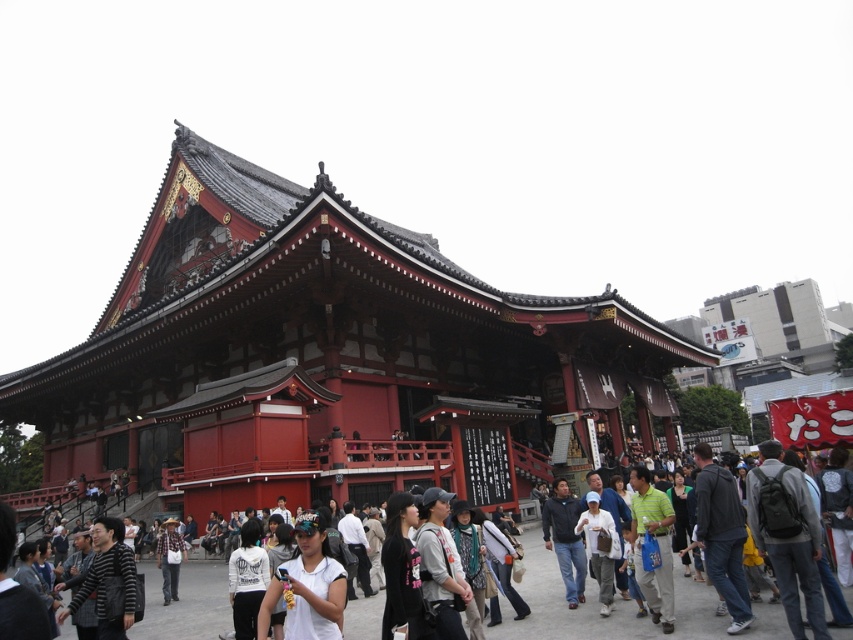
Measure the distance between point (x=432, y=609) and camera.

A distance of 35.39 meters exists between point (x=432, y=609) and camera.

Is the position of gray fabric backpack at center more distant than that of green matte shirt at center?

No, it is in front of green matte shirt at center.

Which is in front, point (422, 515) or point (646, 506)?

Positioned in front is point (422, 515).

Find the location of a particular element. gray fabric backpack at center is located at coordinates (440, 564).

You are a GUI agent. You are given a task and a screenshot of the screen. Output one action in this format:
    pyautogui.click(x=<x>, y=<y>)
    Task: Click on the black matte shirt at center
    
    Given the screenshot: What is the action you would take?
    pyautogui.click(x=402, y=572)

Does black matte shirt at center come in front of plaid shirt at center?

Yes, black matte shirt at center is closer to the viewer.

What are the coordinates of `black matte shirt at center` in the screenshot? It's located at (402, 572).

Does gray fabric backpack at center have a smaller size compared to striped sweater at lower left?

Indeed, gray fabric backpack at center has a smaller size compared to striped sweater at lower left.

Is gray fabric backpack at center taller than striped sweater at lower left?

Incorrect, gray fabric backpack at center's height is not larger of striped sweater at lower left's.

Is point (421, 561) closer to camera compared to point (107, 566)?

Yes, it is in front of point (107, 566).

Find the location of a particular element. The width and height of the screenshot is (853, 640). gray fabric backpack at center is located at coordinates (440, 564).